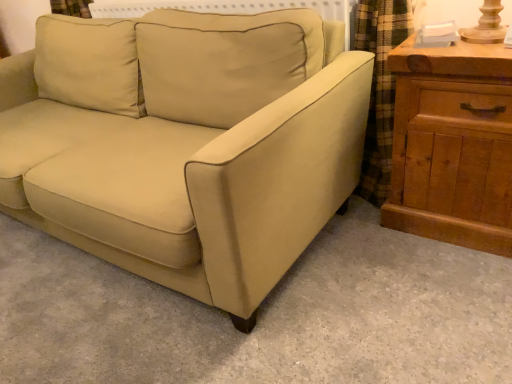
Where is `vacant space in front of wooden chest of drawers at right`? The width and height of the screenshot is (512, 384). vacant space in front of wooden chest of drawers at right is located at coordinates (451, 283).